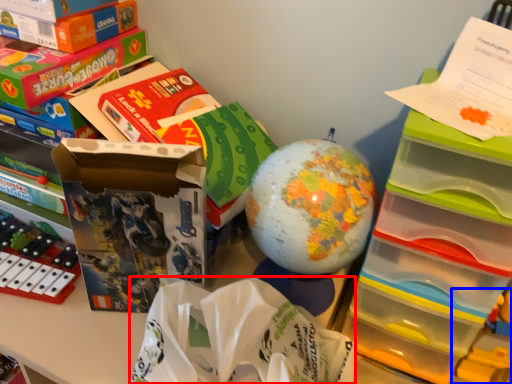
Question: Which object appears farthest to the camera in this image, paper bag (highlighted by a red box) or toy (highlighted by a blue box)?

Choices:
 (A) paper bag
 (B) toy

Answer: (B)